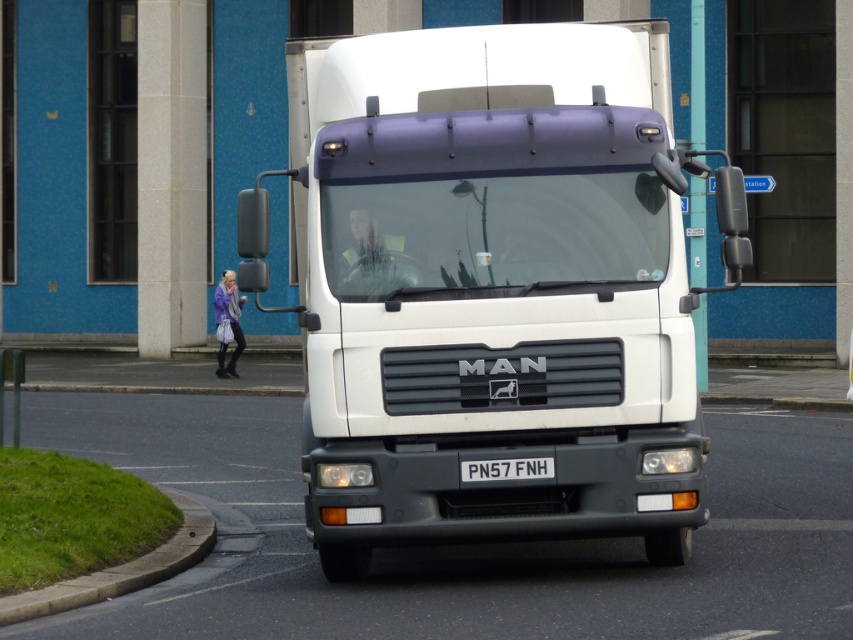
In the scene shown: You are a traffic officer observing a scene with a white glossy trailer truck at center and a black metal license plate at center. Which object is closer to you?

The white glossy trailer truck at center is closer to you because it is in front of the black metal license plate at center.